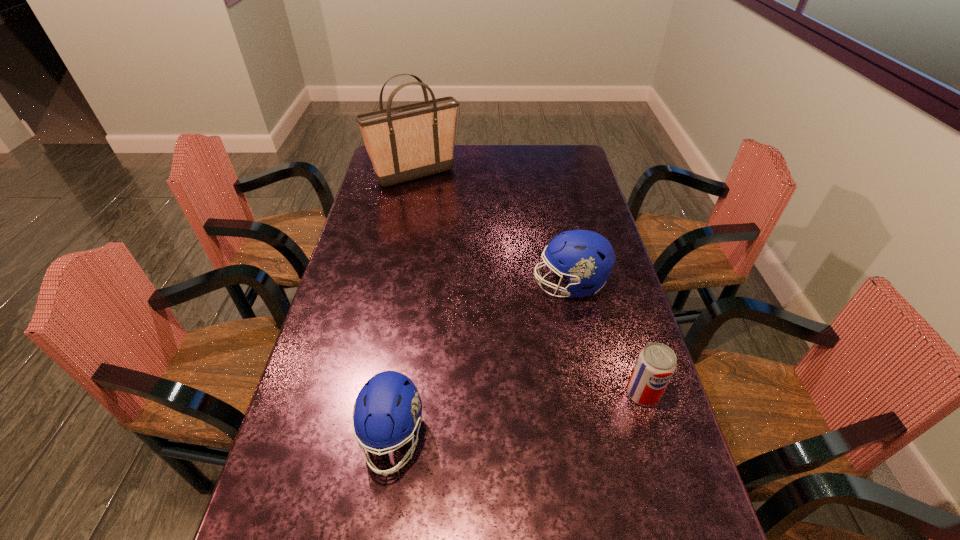
Find the location of a particular element. The image size is (960, 540). the farthest object is located at coordinates (404, 143).

Locate an element on the screen. The image size is (960, 540). shopping bag is located at coordinates (404, 143).

Find the location of `the right football helmet`. the right football helmet is located at coordinates (586, 258).

You are a GUI agent. You are given a task and a screenshot of the screen. Output one action in this format:
    pyautogui.click(x=<x>, y=<y>)
    Task: Click on the farther football helmet
    Image resolution: width=960 pixels, height=540 pixels.
    Given the screenshot: What is the action you would take?
    pyautogui.click(x=586, y=258)

The height and width of the screenshot is (540, 960). What are the coordinates of `the left football helmet` in the screenshot? It's located at (388, 409).

Locate an element on the screen. The width and height of the screenshot is (960, 540). soda is located at coordinates (656, 363).

At what (x,y) coordinates should I click in order to perform the action: click on vacant space situated 0.130m on the right of the farthest object. Please return your answer as a coordinate pair (x, y). The height and width of the screenshot is (540, 960). Looking at the image, I should click on (492, 175).

This screenshot has width=960, height=540. Find the location of `vacant space located on the face guard of the right football helmet`. vacant space located on the face guard of the right football helmet is located at coordinates (503, 285).

This screenshot has height=540, width=960. Find the location of `free space located 0.230m on the face guard of the right football helmet`. free space located 0.230m on the face guard of the right football helmet is located at coordinates (458, 285).

The image size is (960, 540). In order to click on free spot located on the face guard of the right football helmet in this screenshot , I will do click(510, 285).